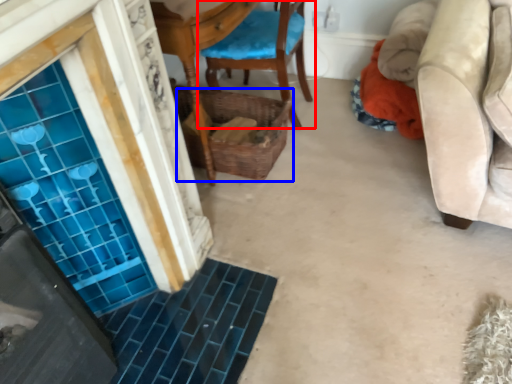
Question: Which object is closer to the camera taking this photo, chair (highlighted by a red box) or basket (highlighted by a blue box)?

Choices:
 (A) chair
 (B) basket

Answer: (A)